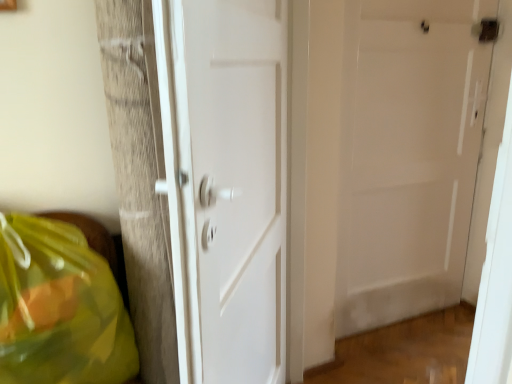
Question: From the image's perspective, relative to translucent yellow plastic bag at lower left, is white glossy door at center, acting as the 2th door starting from the back, above or below?

Choices:
 (A) below
 (B) above

Answer: (B)

Question: Is white glossy door at center, the 1th door viewed from the front, bigger or smaller than translucent yellow plastic bag at lower left?

Choices:
 (A) small
 (B) big

Answer: (B)

Question: Estimate the real-world distances between objects in this image. Which object is farther from the white matte door at center, placed as the second door when sorted from front to back?

Choices:
 (A) white glossy door at center, the 1th door viewed from the front
 (B) translucent yellow plastic bag at lower left

Answer: (B)

Question: Based on their relative distances, which object is farther from the translucent yellow plastic bag at lower left?

Choices:
 (A) white matte door at center, placed as the second door when sorted from left to right
 (B) white glossy door at center, the 1th door from the left

Answer: (A)